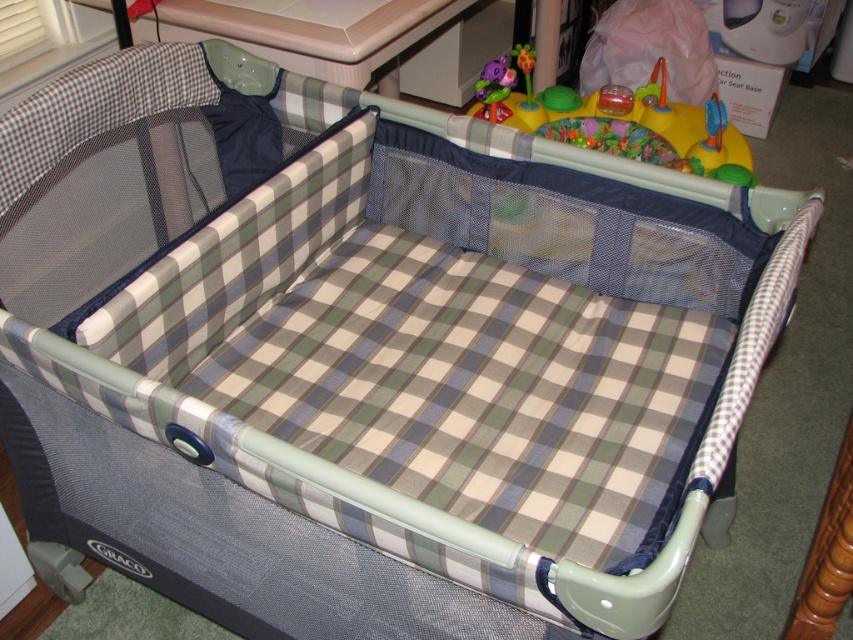
You are a parent trying to place a rubberized plastic toy at center into the playpen. The rubberized plastic play gym at upper center is in the way. Can you move the toy past the play gym without removing the gym?

The rubberized plastic play gym at upper center is closer to the viewer than the rubberized plastic toy at center, so the toy is behind the play gym. Therefore, you cannot move the toy past the play gym without moving the gym itself.

Based on the photo, you are a parent trying to place a small toy in the playpen. You have two points marked as potential spots to place it. The first point is at coordinates point (699, 112) and the second is at point (525, 54). Which point is closer to the front of the playpen?

Point (525, 54) is closer to the front of the playpen because it is in front of point (699, 112).